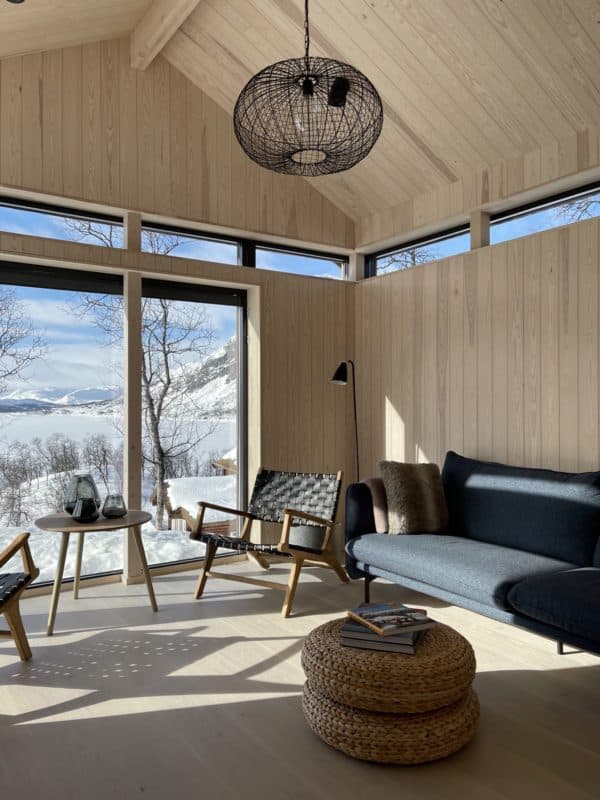
The image size is (600, 800). I want to click on lighting, so click(315, 126).